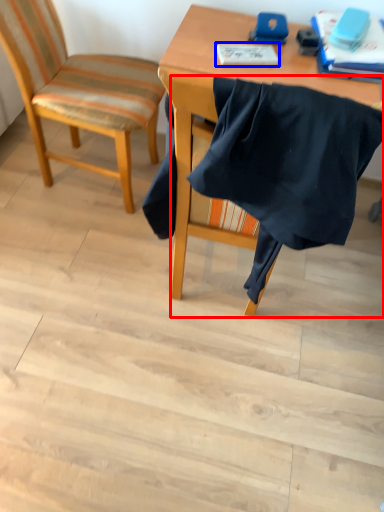
Question: Among these objects, which one is farthest to the camera, chair (highlighted by a red box) or notebook (highlighted by a blue box)?

Choices:
 (A) chair
 (B) notebook

Answer: (B)